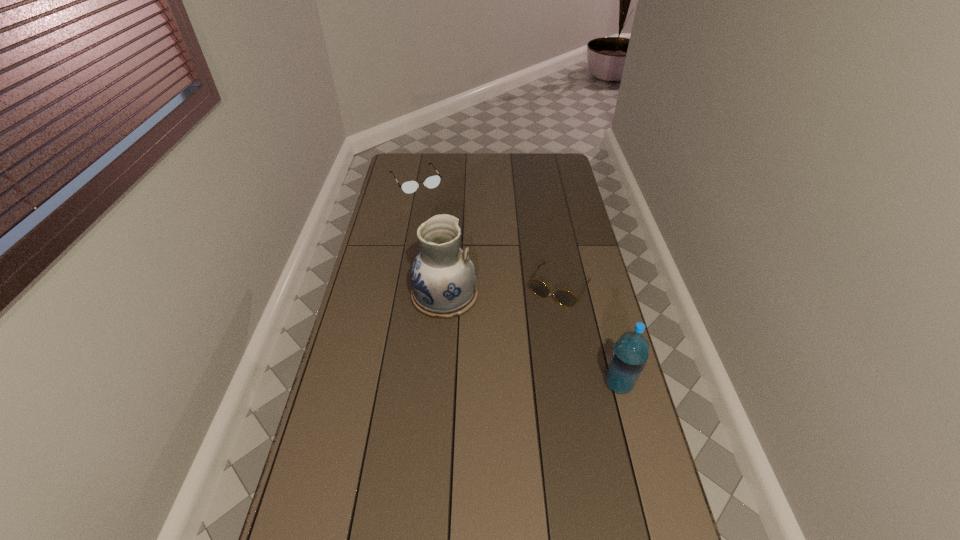
Find the location of `free space at the right edge of the desktop`. free space at the right edge of the desktop is located at coordinates (637, 433).

The width and height of the screenshot is (960, 540). Find the location of `vacant area at the far right corner`. vacant area at the far right corner is located at coordinates (555, 157).

At what (x,y) coordinates should I click in order to perform the action: click on vacant area at the near right corner. Please return your answer as a coordinate pair (x, y). This screenshot has width=960, height=540. Looking at the image, I should click on (625, 521).

I want to click on free spot between the sunglasses and the spectacles, so click(x=488, y=234).

Identify the location of free space between the pottery and the sunglasses. (502, 291).

Identify the location of free spot between the water bottle and the spectacles. The image size is (960, 540). (517, 282).

At what (x,y) coordinates should I click in order to perform the action: click on blank region between the sunglasses and the nearest object. Please return your answer as a coordinate pair (x, y). Looking at the image, I should click on (589, 335).

I want to click on free space between the pottery and the nearest object, so click(x=532, y=340).

The height and width of the screenshot is (540, 960). What are the coordinates of `free space between the spectacles and the sunglasses` in the screenshot? It's located at (488, 234).

At what (x,y) coordinates should I click in order to perform the action: click on free space that is in between the sunglasses and the second tallest object. Please return your answer as a coordinate pair (x, y). The image size is (960, 540). Looking at the image, I should click on (589, 335).